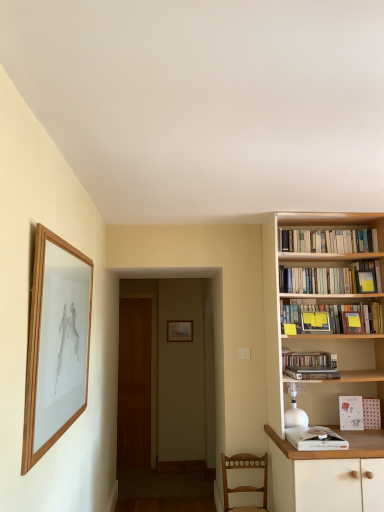
Question: From the image's perspective, relative to matte wooden picture frame at center, the first picture frame ordered from the bottom, is white glossy lamp at right above or below?

Choices:
 (A) below
 (B) above

Answer: (A)

Question: Would you say white glossy lamp at right is to the left or to the right of matte wooden picture frame at center, acting as the second picture frame starting from the front, in the picture?

Choices:
 (A) right
 (B) left

Answer: (A)

Question: Which object is the closest to the white paperbacks at upper right, the sixth book positioned from the bottom?

Choices:
 (A) hardcover books at upper right, which is counted as the second book, starting from the top
 (B) wooden bookshelf at right
 (C) white paper card at right, marked as the 5th book in a top-to-bottom arrangement
 (D) white paper book at lower right, which is counted as the first book, starting from the bottom
 (E) hardcover books at right, positioned as the 4th book in top-to-bottom order

Answer: (A)

Question: Considering the real-world distances, which object is farthest from the wooden chair at lower right?

Choices:
 (A) white glossy lamp at right
 (B) matte wooden picture frame at center, placed as the 1th picture frame when sorted from right to left
 (C) wooden picture frame at left, acting as the 2th picture frame starting from the back
 (D) hardcover books at upper right, which is counted as the second book, starting from the top
 (E) white paper card at right, the second book positioned from the bottom

Answer: (B)